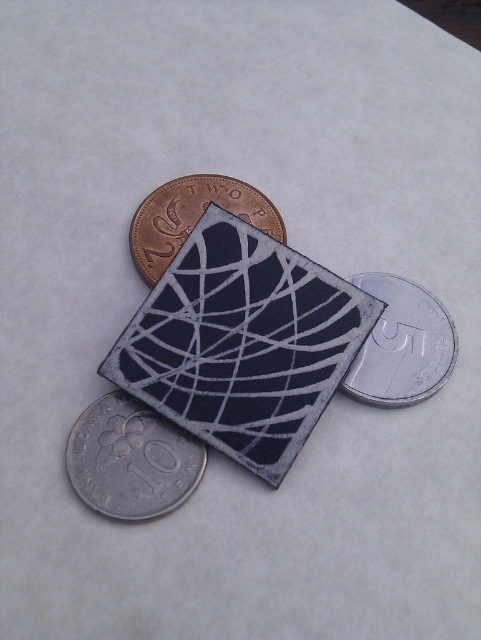
You are a robot with a 12 inch arm reach. You need to pick up the silver metallic coin at right and the brass metallic coin at upper left. Can you reach both coins without moving your position?

The distance between the silver metallic coin at right and brass metallic coin at upper left is 12.92 inches. Since your arm can only reach 12 inches, you cannot reach both coins without moving your position.

In the scene shown: You are trying to stack the coins from tallest to shortest. Given that you have the silver metallic coin at lower left and the silver metallic coin at right, which coin should you place at the bottom of the stack?

The silver metallic coin at lower left is shorter than the silver metallic coin at right, so you should place the silver metallic coin at right at the bottom of the stack since it is taller.